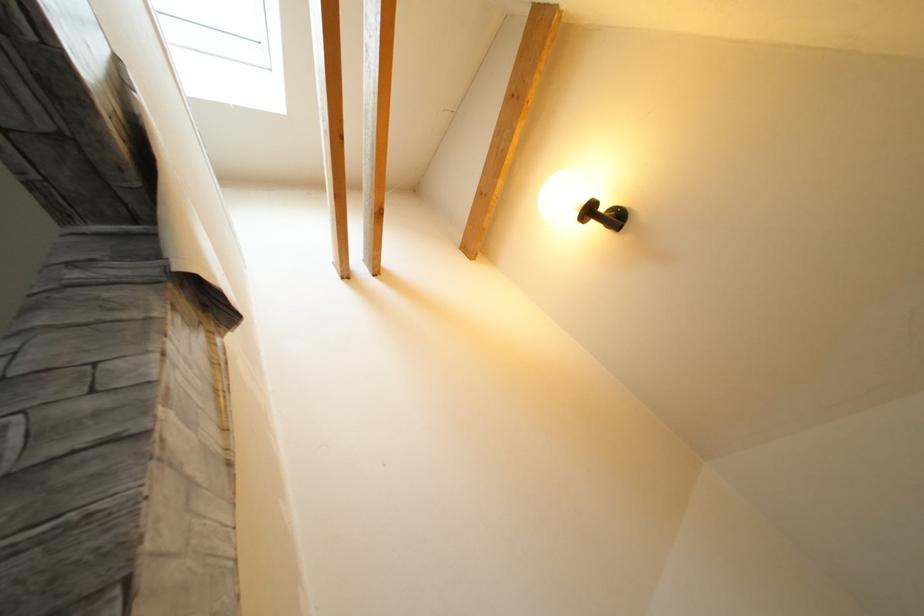
Locate an element on the screen. spherical light bulb is located at coordinates (576, 203).